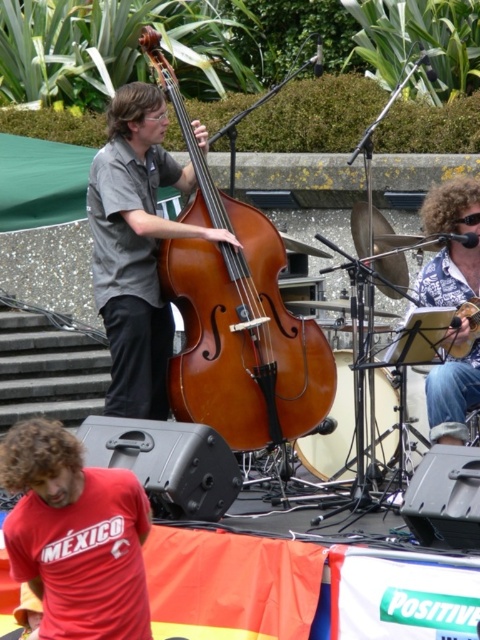
Does red cotton t-shirt at lower left appear on the right side of matte brown double bass at center?

Incorrect, red cotton t-shirt at lower left is not on the right side of matte brown double bass at center.

Between red cotton t-shirt at lower left and matte brown double bass at center, which one appears on the right side from the viewer's perspective?

matte brown double bass at center

This screenshot has height=640, width=480. What do you see at coordinates (75, 536) in the screenshot? I see `red cotton t-shirt at lower left` at bounding box center [75, 536].

This screenshot has height=640, width=480. Identify the location of red cotton t-shirt at lower left. (75, 536).

Can you confirm if shiny brown cello at center is thinner than red cotton t-shirt at lower left?

No, shiny brown cello at center is not thinner than red cotton t-shirt at lower left.

Is shiny brown cello at center taller than red cotton t-shirt at lower left?

Indeed, shiny brown cello at center has a greater height compared to red cotton t-shirt at lower left.

Does point (245, 348) lie behind point (118, 545)?

Yes, point (245, 348) is behind point (118, 545).

Where is `shiny brown cello at center`? The image size is (480, 640). shiny brown cello at center is located at coordinates (237, 316).

Does shiny brown cello at center have a lesser width compared to matte brown double bass at center?

Incorrect, shiny brown cello at center's width is not less than matte brown double bass at center's.

Between shiny brown cello at center and matte brown double bass at center, which one has less height?

matte brown double bass at center is shorter.

Measure the distance between point (196,360) and camera.

Point (196,360) and camera are 31.55 feet apart from each other.

The width and height of the screenshot is (480, 640). I want to click on shiny brown cello at center, so click(237, 316).